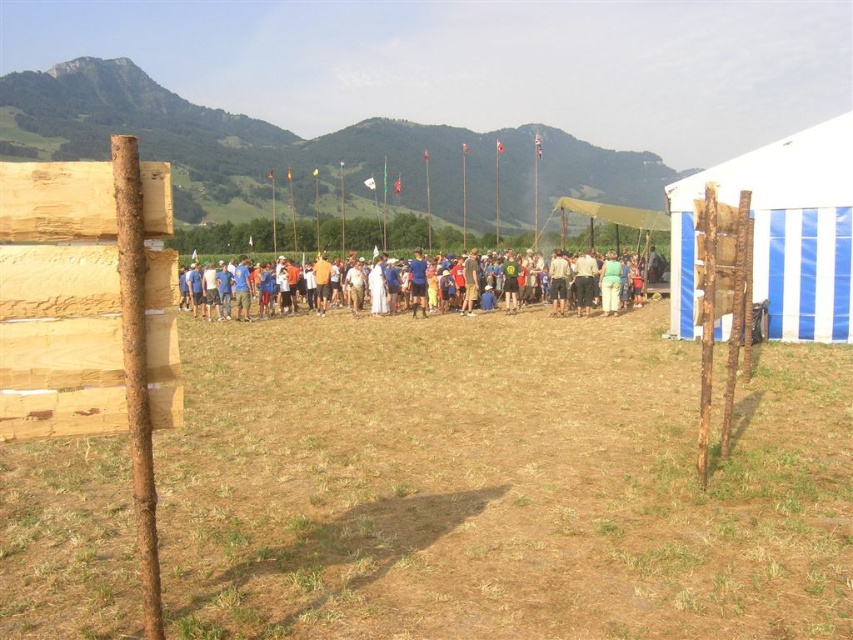
Looking at this image, you are at the gathering and want to set up a picnic blanket near the blue striped tent at right. Where should you place it to ensure it doesn not block the view of the mountains?

Place the picnic blanket near the blue striped tent at right but keep it positioned so it doesn not obstruct the scenic backdrop of rolling hills and mountains visible in the image.

You are planning to set up a small tent in the brown dry grass at center. The tent requires a space that is wider than the blue fabric people at center. Is the area suitable for your tent?

The brown dry grass at center has a lesser width compared to blue fabric people at center, so the area is not wide enough for the tent which requires a space wider than the blue fabric people at center.

You are planning to set up a picnic area for a small group. You have the blue striped tent at right and the blue fabric people at center in the image. Which object has a larger width that could accommodate more people under it?

The blue fabric people at center have a larger width than the blue striped tent at right, so they can accommodate more people.